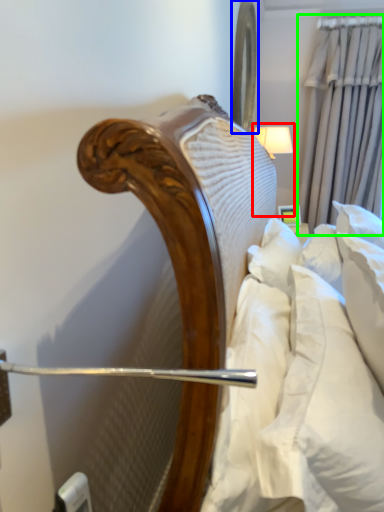
Question: Which object is the closest to the bedside lamp (highlighted by a red box)? Choose among these: mirror (highlighted by a blue box) or curtain (highlighted by a green box).

Choices:
 (A) mirror
 (B) curtain

Answer: (A)